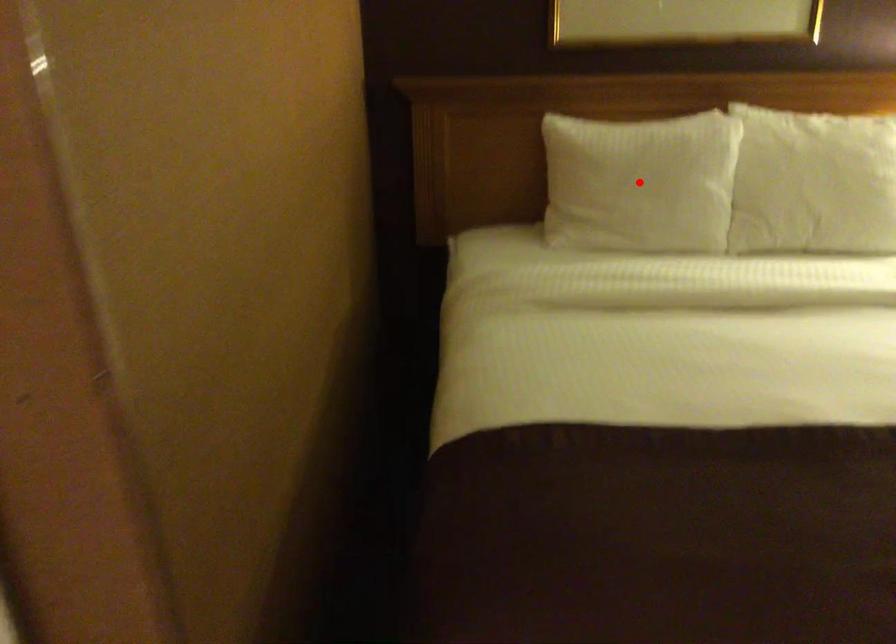
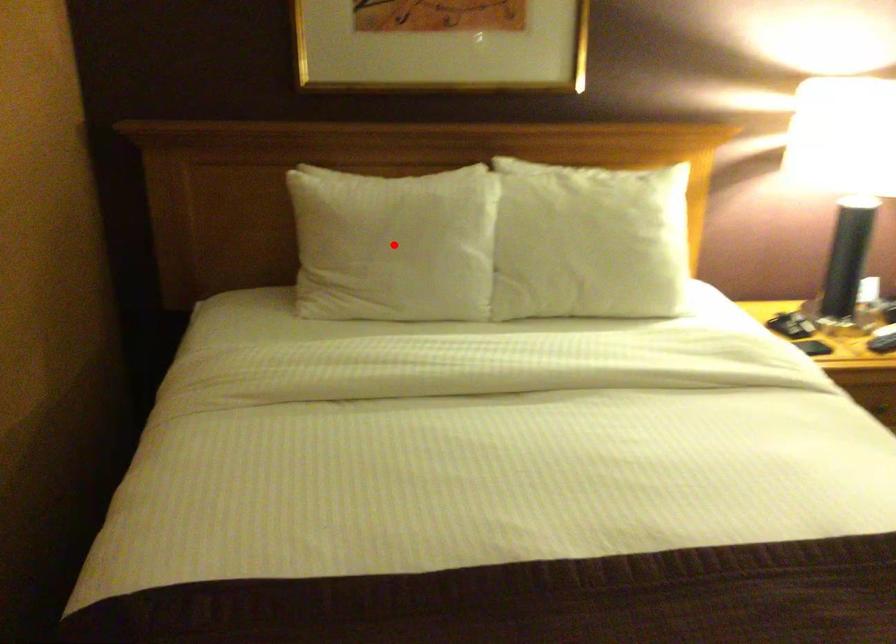
I am providing you with two images of the same scene from different viewpoints. A red point is marked on the first image and another point is marked on the second image. Are the points marked in image1 and image2 representing the same 3D position?

Yes